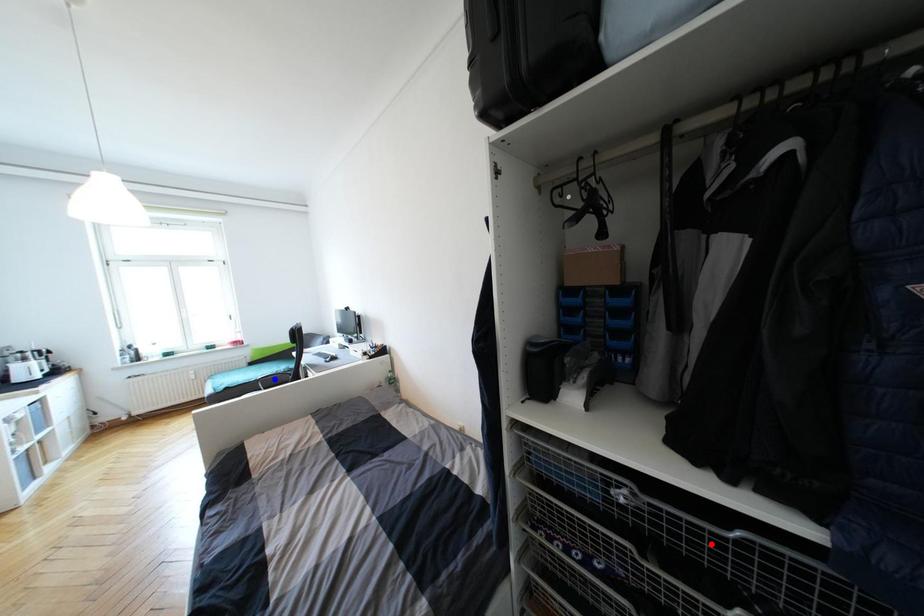
Question: Which of the two points in the image is closer to the camera?

Choices:
 (A) Blue point is closer.
 (B) Red point is closer.

Answer: (B)